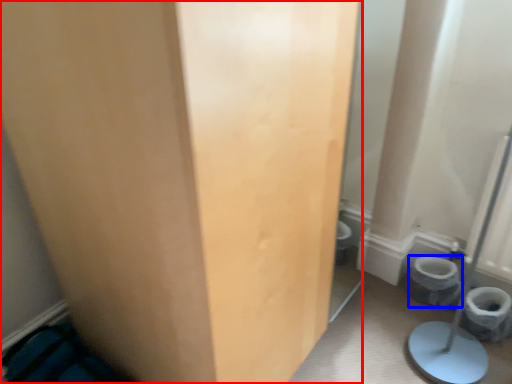
Question: Which object appears farthest to the camera in this image, door (highlighted by a red box) or toilet bowl (highlighted by a blue box)?

Choices:
 (A) door
 (B) toilet bowl

Answer: (B)